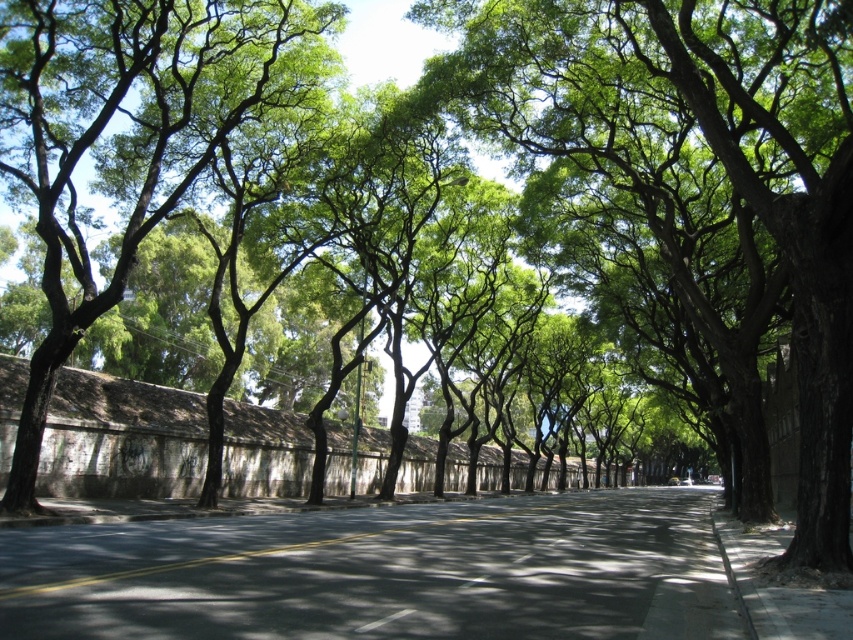
Question: Can you confirm if dark gray asphalt at center is positioned to the left of white glossy line at center?

Choices:
 (A) no
 (B) yes

Answer: (A)

Question: Which object is farther from the camera taking this photo?

Choices:
 (A) white glossy line at center
 (B) dark gray asphalt at center

Answer: (A)

Question: Is dark gray asphalt at center below white glossy line at center?

Choices:
 (A) yes
 (B) no

Answer: (A)

Question: Can you confirm if dark gray asphalt at center is wider than white glossy line at center?

Choices:
 (A) yes
 (B) no

Answer: (A)